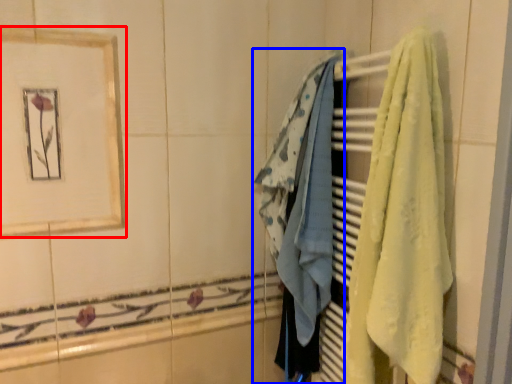
Question: Which point is further to the camera, picture frame (highlighted by a red box) or towel (highlighted by a blue box)?

Choices:
 (A) picture frame
 (B) towel

Answer: (B)